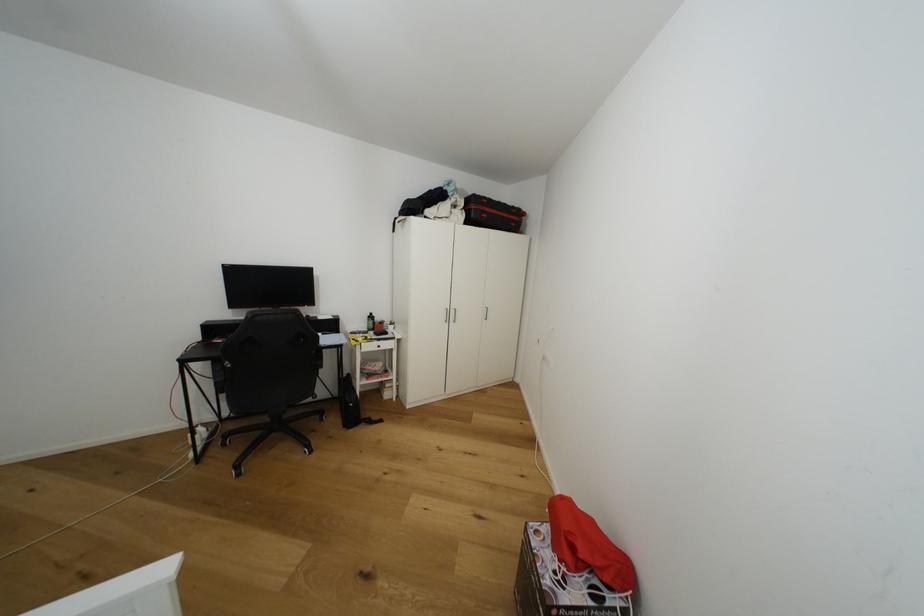
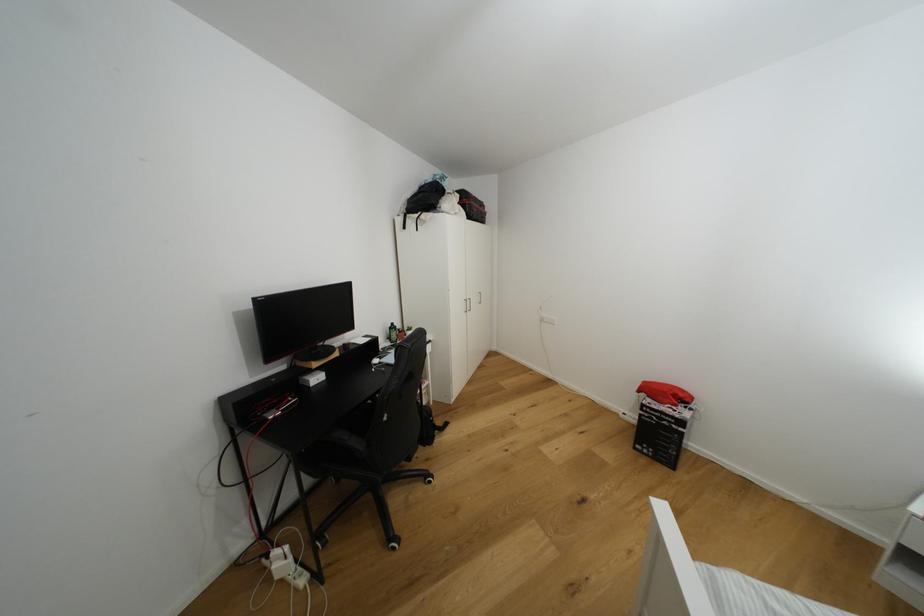
Locate, in the second image, the point that corresponds to point 373,318 in the first image.

(395, 330)